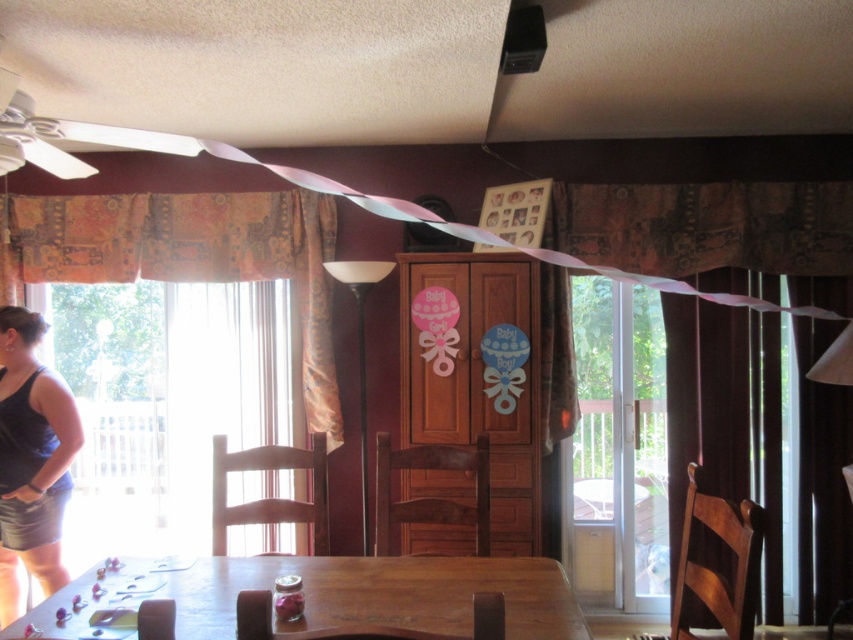
You are standing at the entrance of the dining area and want to place a centerpiece on the wooden table at lower center. According to the coordinates provided, where should you walk to reach the table?

The wooden table at lower center is located at coordinates point (x=344, y=595), so you should walk towards that point to reach the table.

You are standing in the dining area and want to hang a new picture frame on the wall. The frame is 1 meter wide and needs to be placed at the same height as the patterned fabric curtain at left. Is there enough space on the wall to the right of the curtain to fit the frame without overlapping?

Result: The patterned fabric curtain at left is located at point 2D coordinates [187,257]. Since the frame is 1 meter wide and needs to be placed at the same height, there must be at least 1 meter of space to the right of the curtain. However, without knowing the total wall width or the distance from the curtain to the wall edge, it is impossible to determine if there is sufficient space. Therefore, the answer cannot be confirmed with the given information.